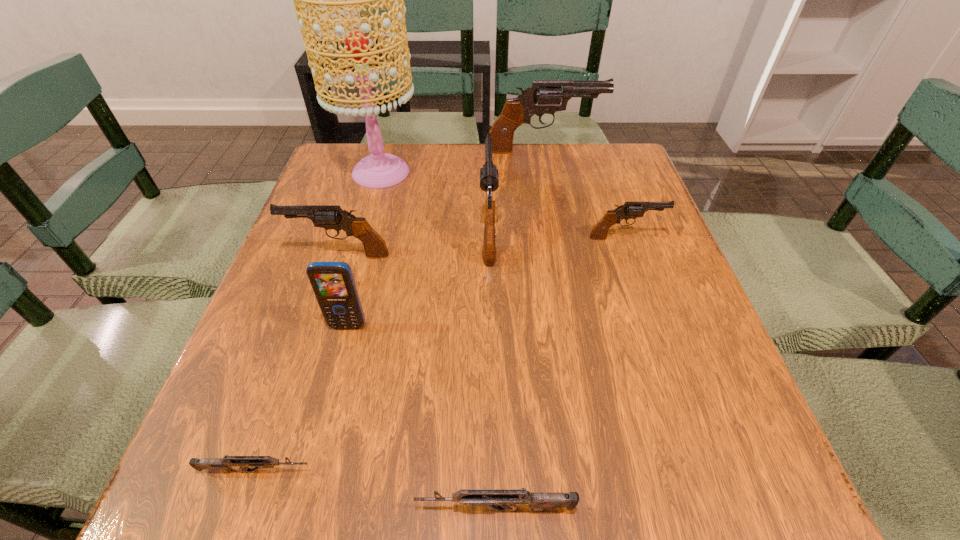
Identify the location of free space located 0.120m aimed along the barrel of the nearest object. The height and width of the screenshot is (540, 960). (329, 509).

Identify the location of vacant point located 0.120m aimed along the barrel of the seventh farthest object. (395, 471).

Where is `lampshade located at the far edge`? lampshade located at the far edge is located at coordinates (379, 170).

Identify the location of gun present at the far edge. (548, 94).

The height and width of the screenshot is (540, 960). Find the location of `lampshade at the left edge`. lampshade at the left edge is located at coordinates (379, 170).

This screenshot has height=540, width=960. What are the coordinates of `cellular telephone situated at the left edge` in the screenshot? It's located at (333, 283).

Locate an element on the screen. object that is positioned at the far left corner is located at coordinates (379, 170).

You are a GUI agent. You are given a task and a screenshot of the screen. Output one action in this format:
    pyautogui.click(x=<x>, y=<y>)
    Task: Click on the object that is at the near left corner
    The height and width of the screenshot is (540, 960).
    Given the screenshot: What is the action you would take?
    pyautogui.click(x=225, y=464)

Locate an element on the screen. The image size is (960, 540). object that is at the far right corner is located at coordinates (548, 94).

Locate an element on the screen. free spot at the far edge of the desktop is located at coordinates (445, 147).